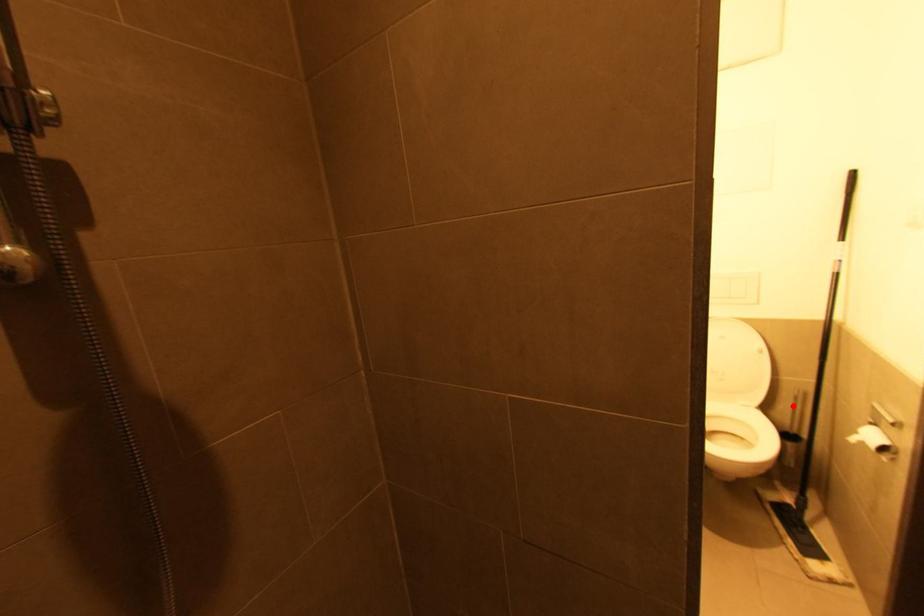
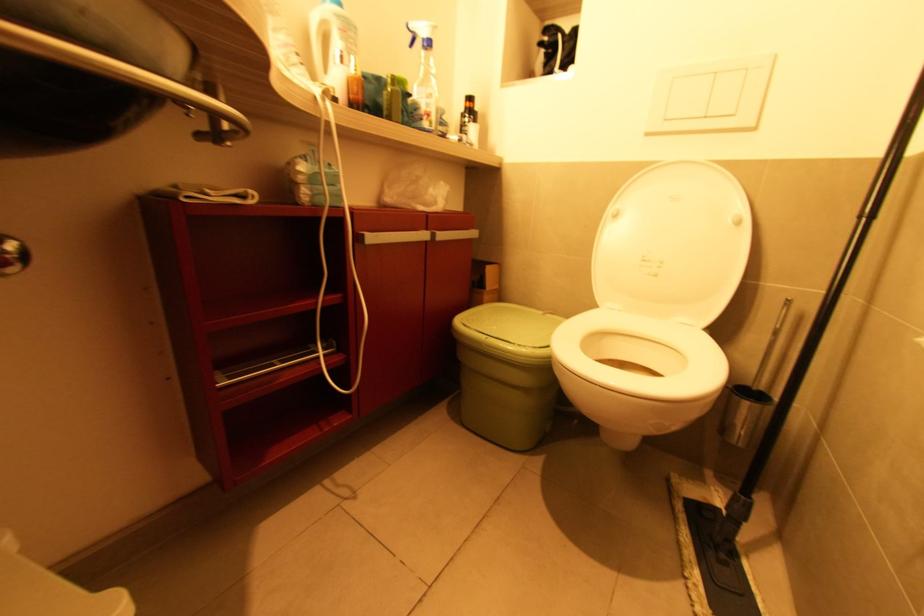
Find the pixel in the second image that matches the highlighted location in the first image.

(771, 338)